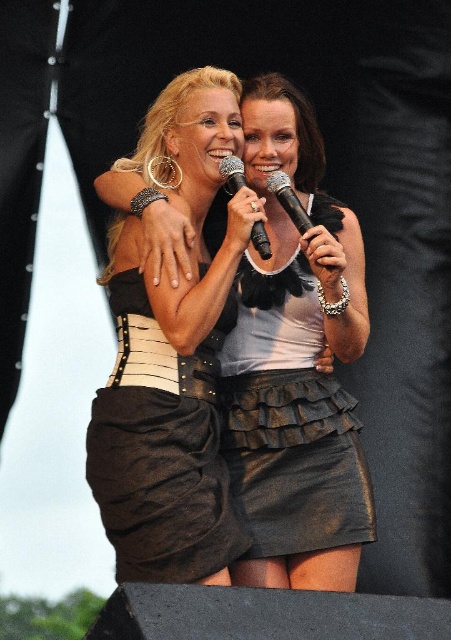
You are a photographer setting up for a stage performance. You notice the matte black dress at center and the black plastic microphone at center. Which object appears taller in the image?

The black plastic microphone at center is taller than the matte black dress at center.

You are a stagehand setting up for a performance. You need to place a new prop that requires knowing which object is taller between the black leather skirt at center and the black plastic microphone at center. Which one is taller?

The black leather skirt at center is taller than the black plastic microphone at center according to the description.

You are a stagehand setting up a spotlight for the performance. The spotlight can only illuminate a specific point on the stage. According to the scene, what object is located at the coordinates point (289, 422)?

The denim skirt at center is located at point (289, 422).